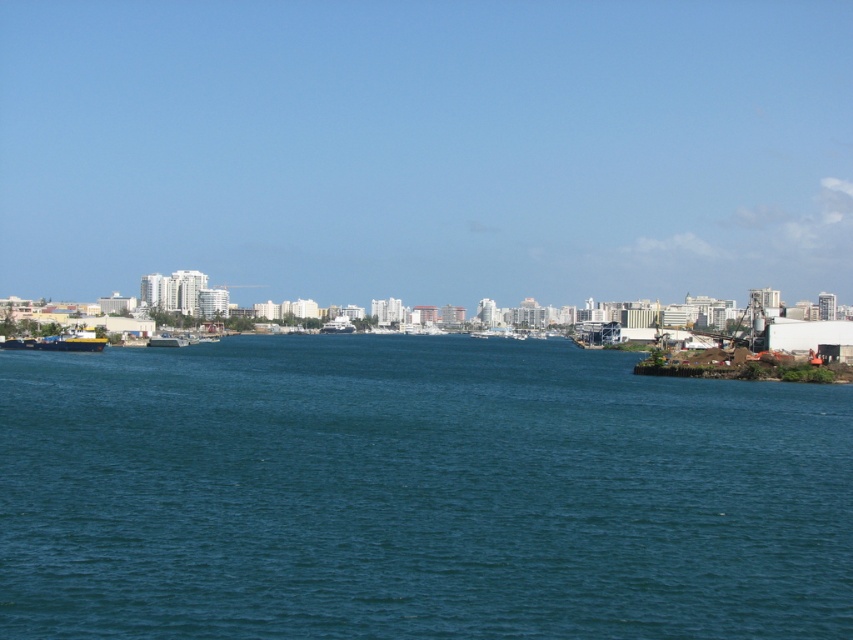
Locate an element on the screen. teal water at center is located at coordinates (415, 493).

Where is `teal water at center`? This screenshot has height=640, width=853. teal water at center is located at coordinates (415, 493).